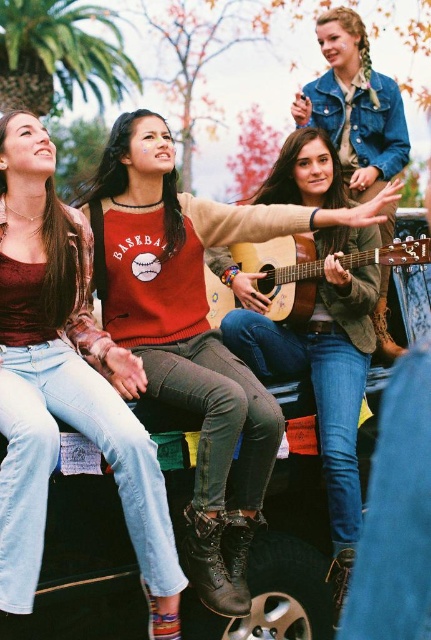
Question: Which is nearer to the green leafy palm tree at upper left?

Choices:
 (A) acoustic wood guitar at center
 (B) red sweater at center
 (C) matte red sweater at left
 (D) leather boot at lower center

Answer: (B)

Question: Which is farther from the green leafy palm tree at upper left?

Choices:
 (A) matte red sweater at left
 (B) acoustic wood guitar at center
 (C) leather boot at lower center

Answer: (C)

Question: Does matte red sweater at left have a smaller size compared to green leafy palm tree at upper left?

Choices:
 (A) no
 (B) yes

Answer: (A)

Question: Is green leafy palm tree at upper left above leather boot at lower center?

Choices:
 (A) yes
 (B) no

Answer: (A)

Question: Among these points, which one is farthest from the camera?

Choices:
 (A) (171, 349)
 (B) (280, 301)
 (C) (90, 428)

Answer: (B)

Question: Is green leafy palm tree at upper left to the right of leather boot at lower center from the viewer's perspective?

Choices:
 (A) no
 (B) yes

Answer: (A)